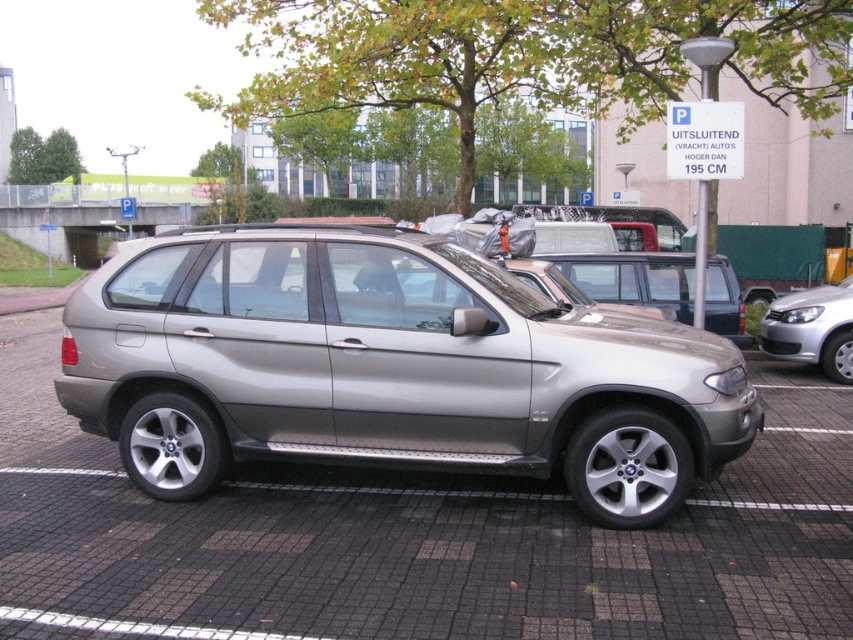
Is point (625, 497) more distant than point (715, 275)?

No.

Is satin silver suv at center above satin silver minivan at center?

Incorrect, satin silver suv at center is not positioned above satin silver minivan at center.

Measure the distance between point (548, 440) and camera.

The distance of point (548, 440) from camera is 4.80 meters.

Where is `satin silver suv at center`? satin silver suv at center is located at coordinates (389, 369).

Does satin silver car at center appear on the right side of satin silver car at right?

Incorrect, satin silver car at center is not on the right side of satin silver car at right.

Between point (764, 522) and point (799, 316), which one is positioned behind?

Point (799, 316)

Identify the location of satin silver car at center. (415, 538).

Consider the image. Which is above, satin silver minivan at center or satin silver car at right?

satin silver minivan at center is higher up.

Is point (633, 269) positioned after point (839, 372)?

No, (633, 269) is in front of (839, 372).

Where is `satin silver minivan at center`? This screenshot has width=853, height=640. satin silver minivan at center is located at coordinates (633, 278).